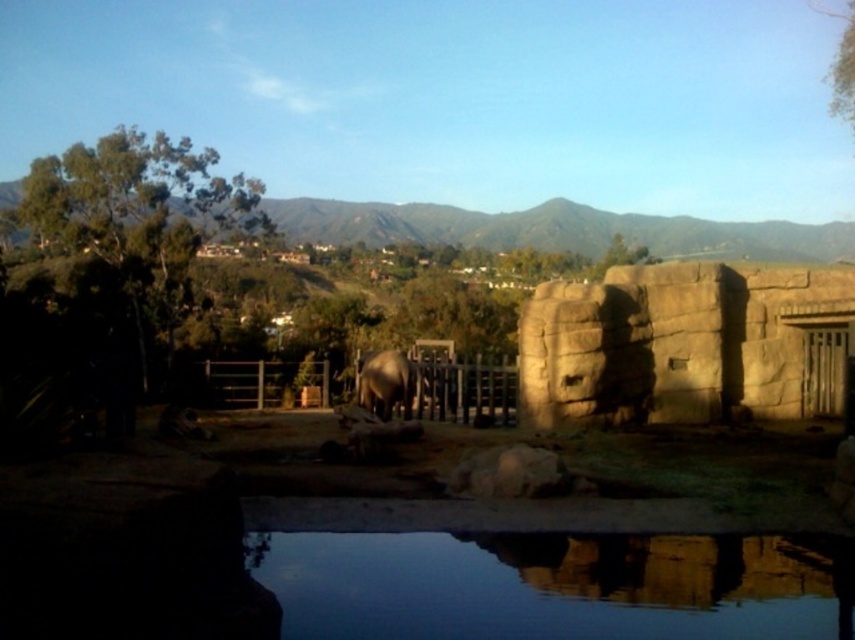
You are standing at the entrance of the zoo and see the smooth reflective water at lower center and the brown stone wall at center right. Which object is closer to your left side?

The smooth reflective water at lower center is to the left of the brown stone wall at center right, so it is closer to your left side.

You are a zookeeper planning to walk from the stone enclosure on the right to the elephant at center. Which object, the smooth reflective water at lower center or the gray matte elephant at center, will you cross first?

The smooth reflective water at lower center is wider than the gray matte elephant at center, so you will cross the smooth reflective water at lower center first on your way to the elephant.